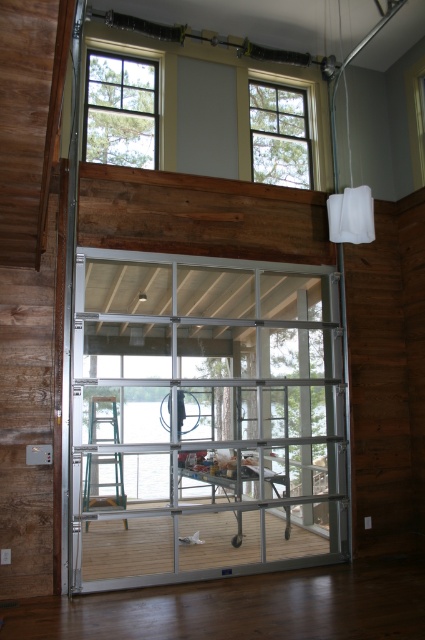
Question: Which point is closer to the camera?

Choices:
 (A) clear glass door at center
 (B) clear glass window at upper left
 (C) clear glass window at upper center
 (D) green plastic ladder at lower left

Answer: (A)

Question: Which of the following is the farthest from the observer?

Choices:
 (A) clear glass window at upper left
 (B) clear glass window at upper center
 (C) green plastic ladder at lower left
 (D) clear glass door at center

Answer: (C)

Question: Which is nearer to the clear glass window at upper left?

Choices:
 (A) green plastic ladder at lower left
 (B) clear glass window at upper center
 (C) clear glass door at center

Answer: (B)

Question: Is clear glass window at upper left wider than clear glass window at upper center?

Choices:
 (A) no
 (B) yes

Answer: (A)

Question: Is clear glass door at center positioned behind green plastic ladder at lower left?

Choices:
 (A) yes
 (B) no

Answer: (B)

Question: Is clear glass window at upper center to the right of green plastic ladder at lower left from the viewer's perspective?

Choices:
 (A) yes
 (B) no

Answer: (A)